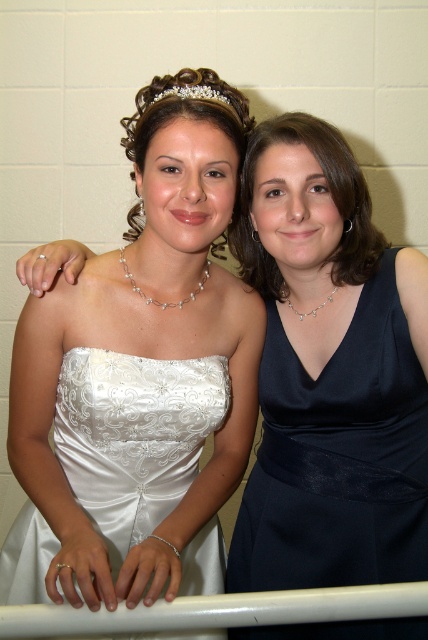
Question: Which object is the farthest from the pearl/textured tiara at upper center?

Choices:
 (A) white plastic rail at lower center
 (B) clear crystal tiara at upper center

Answer: (A)

Question: Does satin white dress at center come in front of navy satin dress at right?

Choices:
 (A) no
 (B) yes

Answer: (B)

Question: Which object appears farthest from the camera in this image?

Choices:
 (A) clear crystal tiara at upper center
 (B) satin white dress at center

Answer: (A)

Question: Can you confirm if navy satin dress at right is thinner than clear crystal tiara at upper center?

Choices:
 (A) no
 (B) yes

Answer: (A)

Question: Among these objects, which one is farthest from the camera?

Choices:
 (A) white plastic rail at lower center
 (B) satin white dress at center

Answer: (B)

Question: Is navy satin dress at right to the left of white satin dress at center from the viewer's perspective?

Choices:
 (A) no
 (B) yes

Answer: (A)